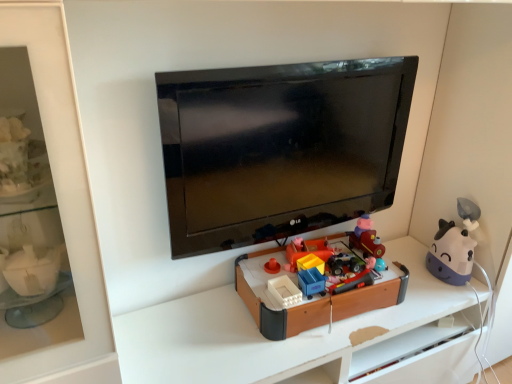
Question: In terms of size, does matte plastic toy train at center, which is the 2th toy in right-to-left order, appear bigger or smaller than bright orange plastic toy at center, acting as the sixth toy starting from the right?

Choices:
 (A) small
 (B) big

Answer: (B)

Question: Looking at their shapes, would you say matte plastic toy train at center, arranged as the fifth toy when viewed from the left, is wider or thinner than bright orange plastic toy at center, acting as the sixth toy starting from the right?

Choices:
 (A) wide
 (B) thin

Answer: (A)

Question: Which of these objects is positioned closest to the rubberized plastic toy car at center, the 3th toy positioned from the left?

Choices:
 (A) brown plastic toy at center, which appears as the 2th toy when viewed from the left
 (B) rubberized plastic toy car at center, the fourth toy when ordered from left to right
 (C) bright orange plastic toy at center, acting as the sixth toy starting from the right
 (D) black glossy tv at center
 (E) matte plastic toy train at center, arranged as the fifth toy when viewed from the left

Answer: (B)

Question: Estimate the real-world distances between objects in this image. Which object is closer to the black glossy tv at center?

Choices:
 (A) purple matte cow at right, which is the first toy in right-to-left order
 (B) bright orange plastic toy at center, acting as the sixth toy starting from the right
 (C) brown plastic toy at center, which appears as the 2th toy when viewed from the left
 (D) matte plastic toy train at center, arranged as the fifth toy when viewed from the left
 (E) rubberized plastic toy car at center, which is the third toy in right-to-left order

Answer: (C)